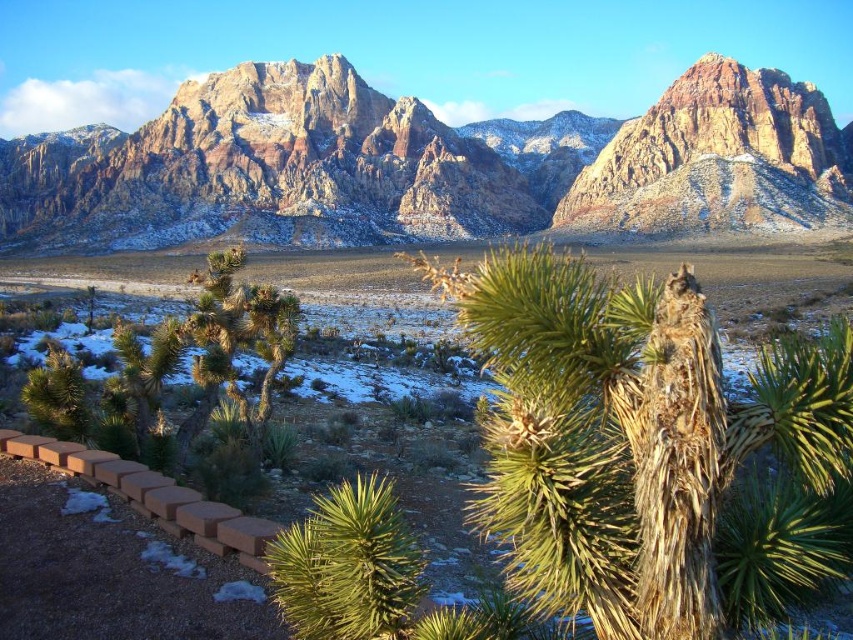
Is rugged sandstone mountains at upper center to the left of green spiky palm tree at lower center from the viewer's perspective?

Correct, you'll find rugged sandstone mountains at upper center to the left of green spiky palm tree at lower center.

The width and height of the screenshot is (853, 640). I want to click on rugged sandstone mountains at upper center, so click(x=426, y=164).